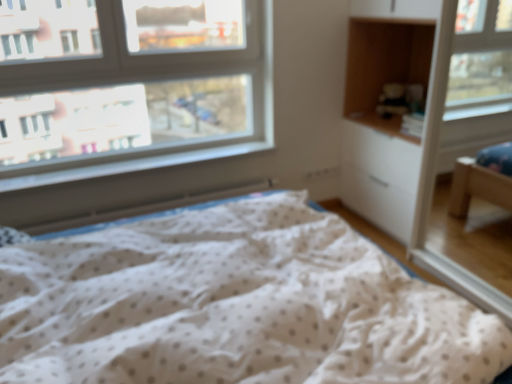
Question: Is clear glass window at upper left facing towards white plastic radiator at lower left?

Choices:
 (A) no
 (B) yes

Answer: (A)

Question: From a real-world perspective, is clear glass window at upper left physically above white plastic radiator at lower left?

Choices:
 (A) no
 (B) yes

Answer: (B)

Question: Is clear glass window at upper left looking in the opposite direction of white plastic radiator at lower left?

Choices:
 (A) no
 (B) yes

Answer: (A)

Question: Is clear glass window at upper left positioned beyond the bounds of white plastic radiator at lower left?

Choices:
 (A) yes
 (B) no

Answer: (A)

Question: Is clear glass window at upper left touching white plastic radiator at lower left?

Choices:
 (A) no
 (B) yes

Answer: (A)

Question: Is white plastic radiator at lower left a part of clear glass window at upper left?

Choices:
 (A) yes
 (B) no

Answer: (B)

Question: Is the depth of white dotted fabric at center less than that of white plastic radiator at lower left?

Choices:
 (A) no
 (B) yes

Answer: (B)

Question: Can you confirm if white dotted fabric at center is positioned to the right of white plastic radiator at lower left?

Choices:
 (A) no
 (B) yes

Answer: (B)

Question: Is white dotted fabric at center not inside white plastic radiator at lower left?

Choices:
 (A) yes
 (B) no

Answer: (A)

Question: From the image's perspective, does white dotted fabric at center appear higher than white plastic radiator at lower left?

Choices:
 (A) no
 (B) yes

Answer: (A)

Question: Is white dotted fabric at center facing towards white plastic radiator at lower left?

Choices:
 (A) no
 (B) yes

Answer: (A)

Question: From the image's perspective, is white dotted fabric at center beneath white plastic radiator at lower left?

Choices:
 (A) no
 (B) yes

Answer: (B)

Question: Is clear glass window at upper left smaller than white dotted fabric at center?

Choices:
 (A) yes
 (B) no

Answer: (A)